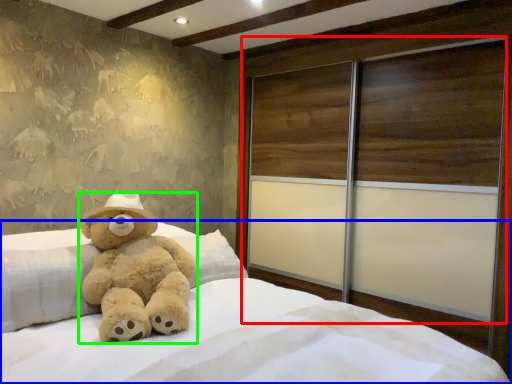
Question: Which object is the farthest from screen door (highlighted by a red box)? Choose among these: bed (highlighted by a blue box) or teddy bear (highlighted by a green box).

Choices:
 (A) bed
 (B) teddy bear

Answer: (B)